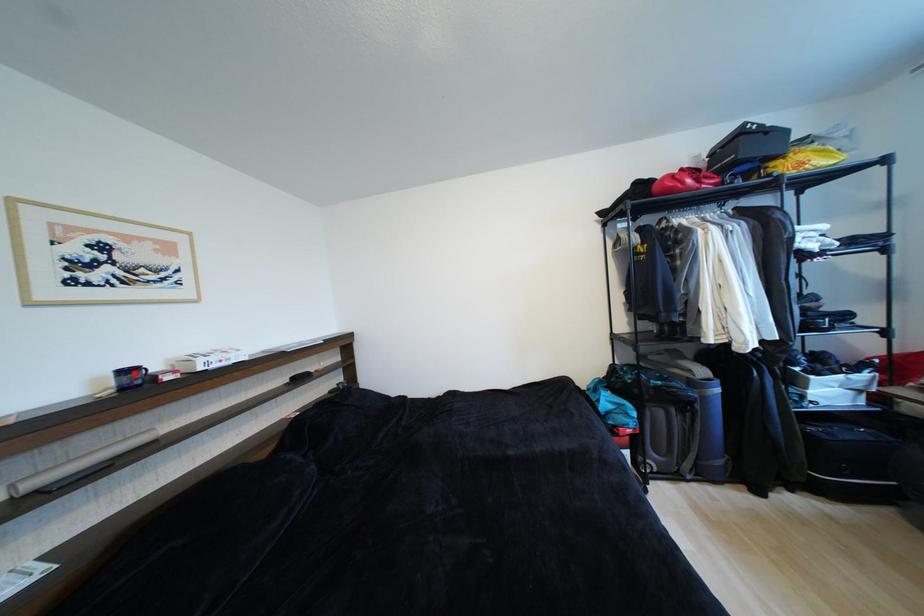
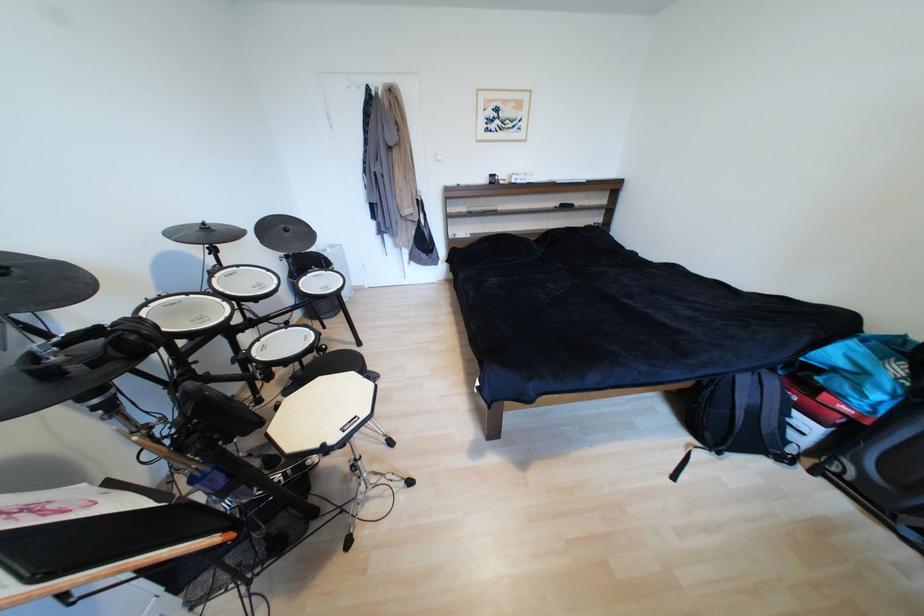
Find the pixel in the second image that matches the highlighted location in the first image.

(499, 177)